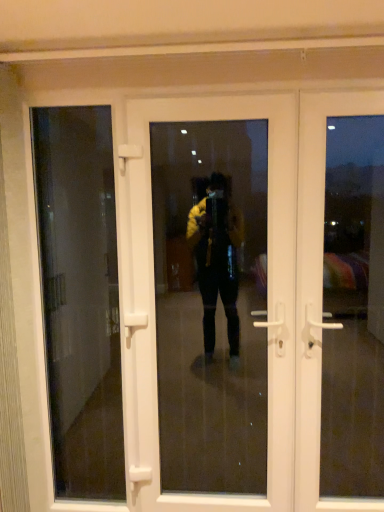
Question: Considering the relative sizes of white plastic door at center, the 1th door in the left-to-right sequence, and white plastic door at right, the first door when ordered from right to left, in the image provided, is white plastic door at center, the 1th door in the left-to-right sequence, shorter than white plastic door at right, the first door when ordered from right to left,?

Choices:
 (A) yes
 (B) no

Answer: (B)

Question: Is white plastic door at center, the 1th door in the left-to-right sequence, at the right side of white plastic door at right, the first door when ordered from right to left?

Choices:
 (A) no
 (B) yes

Answer: (A)

Question: Can white plastic door at right, which is the second door from left to right, be found inside white plastic door at center, the 2th door positioned from the right?

Choices:
 (A) no
 (B) yes

Answer: (A)

Question: Is white plastic door at center, the 2th door positioned from the right, placed right next to white plastic door at right, the first door when ordered from right to left?

Choices:
 (A) yes
 (B) no

Answer: (B)

Question: Does white plastic door at center, the 1th door in the left-to-right sequence, have a greater width compared to white plastic door at right, the first door when ordered from right to left?

Choices:
 (A) yes
 (B) no

Answer: (A)

Question: From the image's perspective, is transparent glass door at left above or below white plastic door at center, the 2th door positioned from the right?

Choices:
 (A) below
 (B) above

Answer: (A)

Question: Considering the positions of transparent glass door at left and white plastic door at center, the 2th door positioned from the right, in the image, is transparent glass door at left wider or thinner than white plastic door at center, the 2th door positioned from the right,?

Choices:
 (A) wide
 (B) thin

Answer: (B)

Question: Would you say transparent glass door at left is inside or outside white plastic door at center, the 2th door positioned from the right?

Choices:
 (A) outside
 (B) inside

Answer: (A)

Question: From their relative heights in the image, would you say transparent glass door at left is taller or shorter than white plastic door at center, the 2th door positioned from the right?

Choices:
 (A) tall
 (B) short

Answer: (A)

Question: Is transparent glass door at left taller or shorter than white plastic door at right, which is the second door from left to right?

Choices:
 (A) short
 (B) tall

Answer: (B)

Question: Considering the relative positions of transparent glass door at left and white plastic door at right, the first door when ordered from right to left, in the image provided, is transparent glass door at left to the left or to the right of white plastic door at right, the first door when ordered from right to left,?

Choices:
 (A) right
 (B) left

Answer: (B)

Question: Considering their positions, is transparent glass door at left located in front of or behind white plastic door at right, which is the second door from left to right?

Choices:
 (A) behind
 (B) front

Answer: (A)

Question: Do you think transparent glass door at left is within white plastic door at right, which is the second door from left to right, or outside of it?

Choices:
 (A) inside
 (B) outside

Answer: (B)

Question: From the image's perspective, is white plastic door at right, the first door when ordered from right to left, above or below white plastic door at center, the 2th door positioned from the right?

Choices:
 (A) above
 (B) below

Answer: (A)

Question: From a real-world perspective, relative to white plastic door at center, the 1th door in the left-to-right sequence, is white plastic door at right, which is the second door from left to right, vertically above or below?

Choices:
 (A) above
 (B) below

Answer: (A)